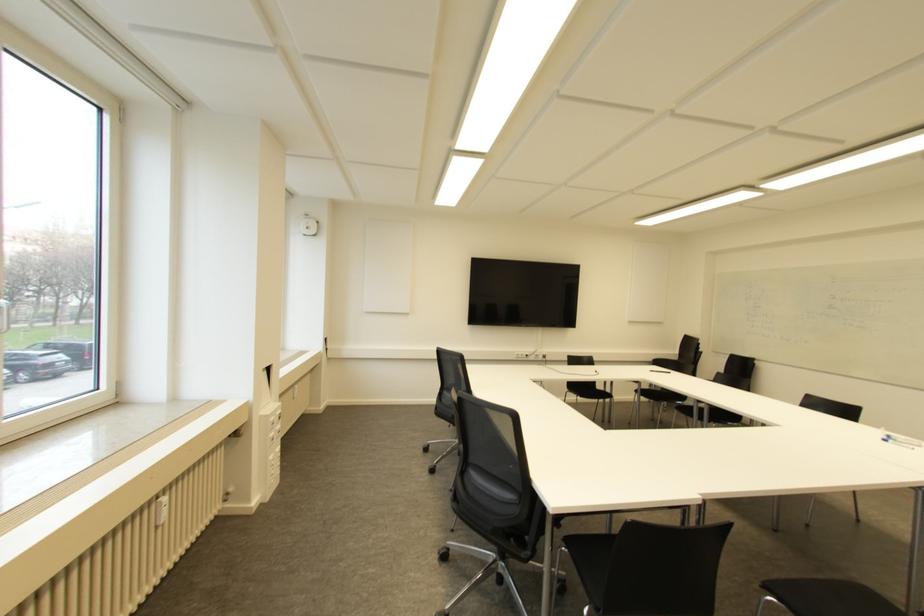
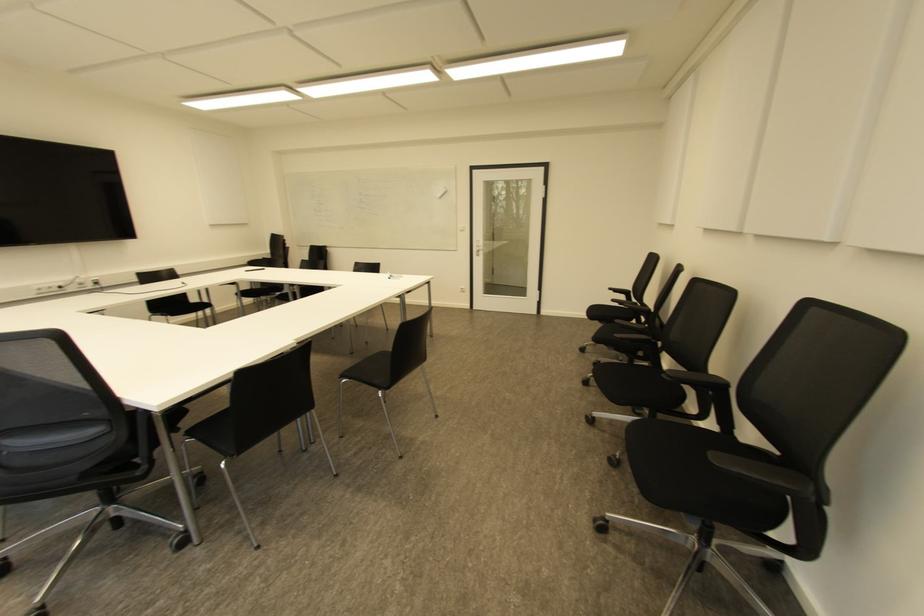
Based on the continuous images, in which direction is the camera rotating?

The rotation direction of the camera is right-down.